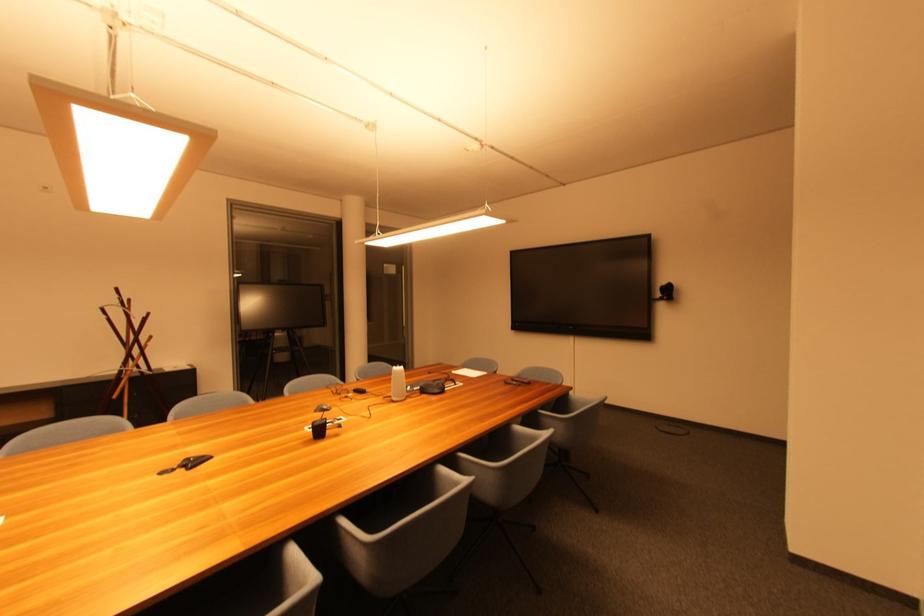
This screenshot has height=616, width=924. In order to click on metal door handle in this screenshot , I will do `click(237, 274)`.